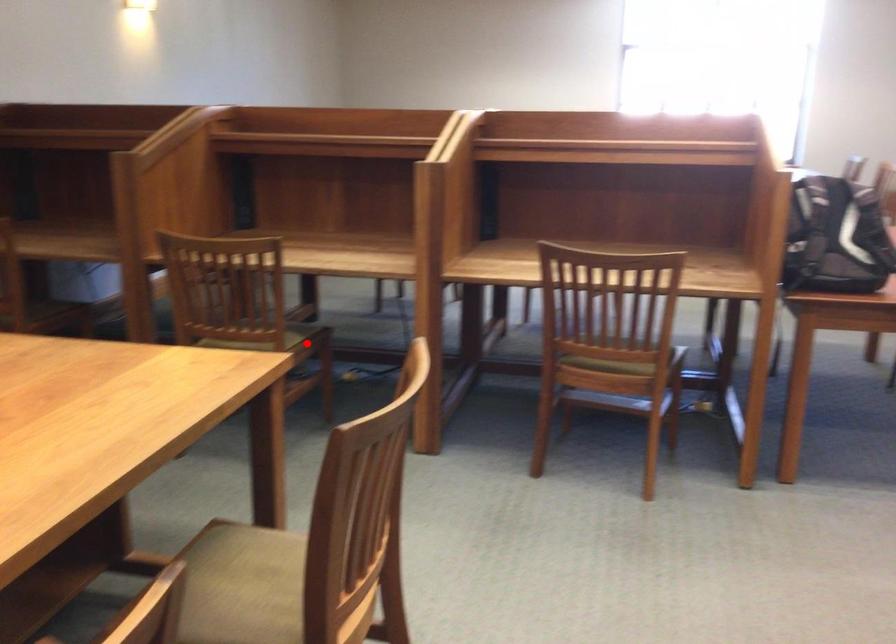
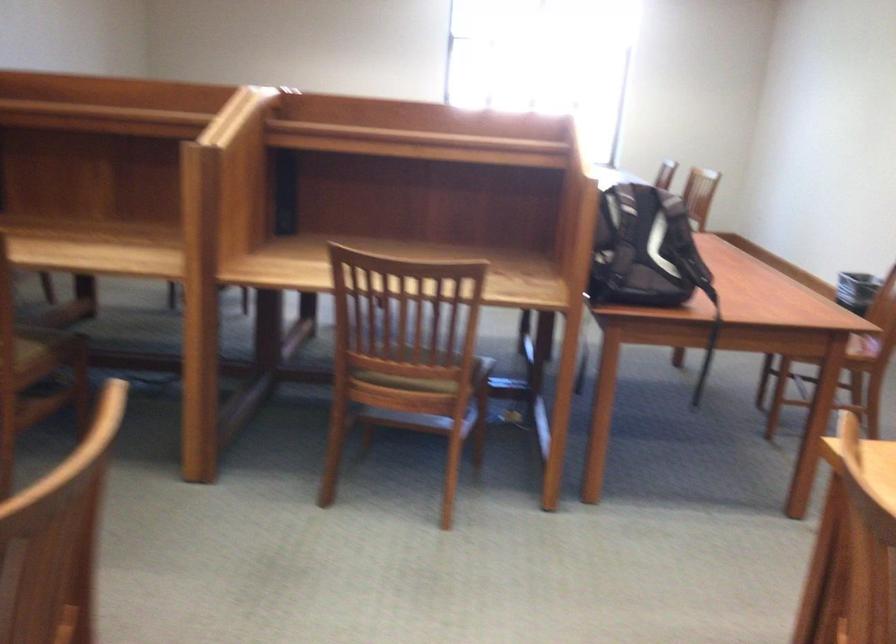
Locate, in the second image, the point that corresponds to the highlighted location in the first image.

(46, 348)